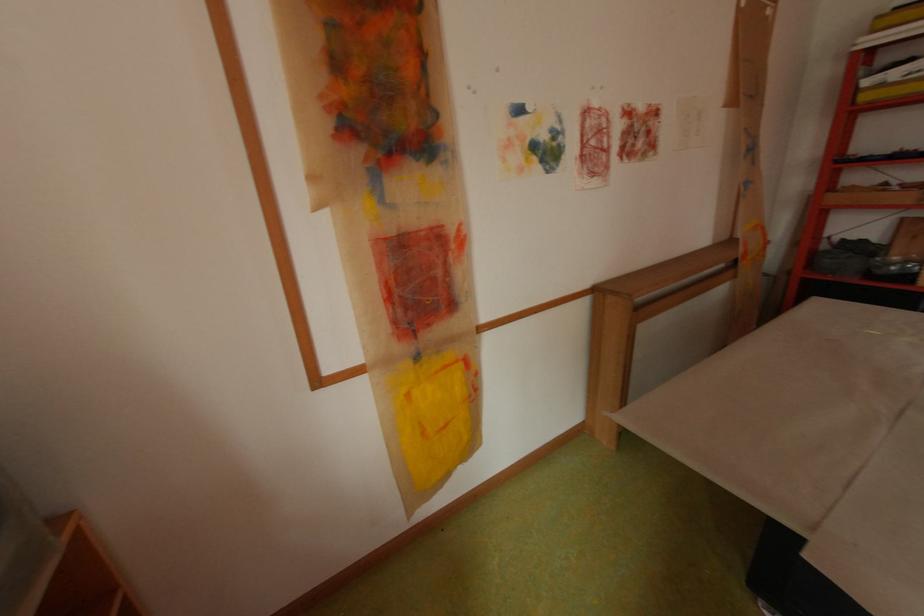
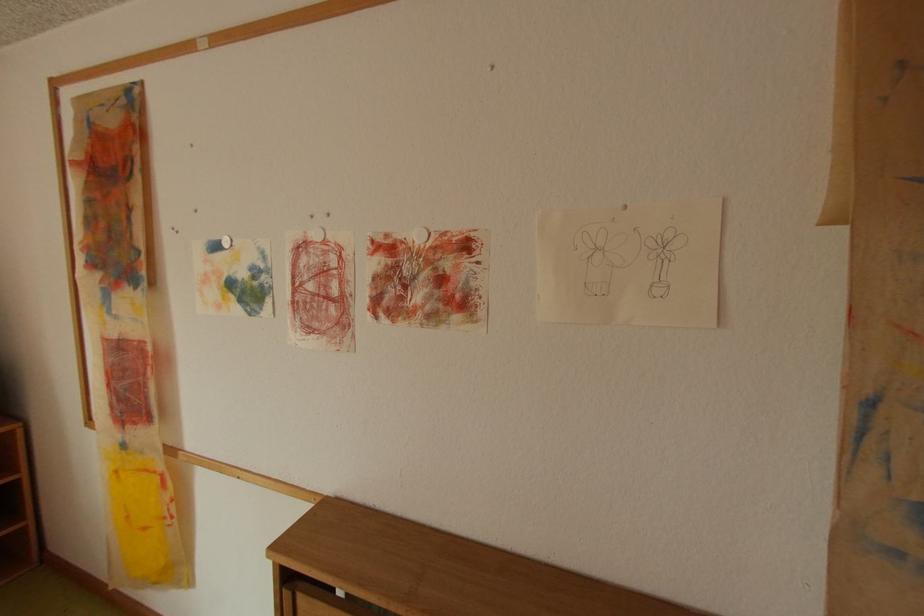
In the second image, find the point that corresponds to (429,358) in the first image.

(134, 446)